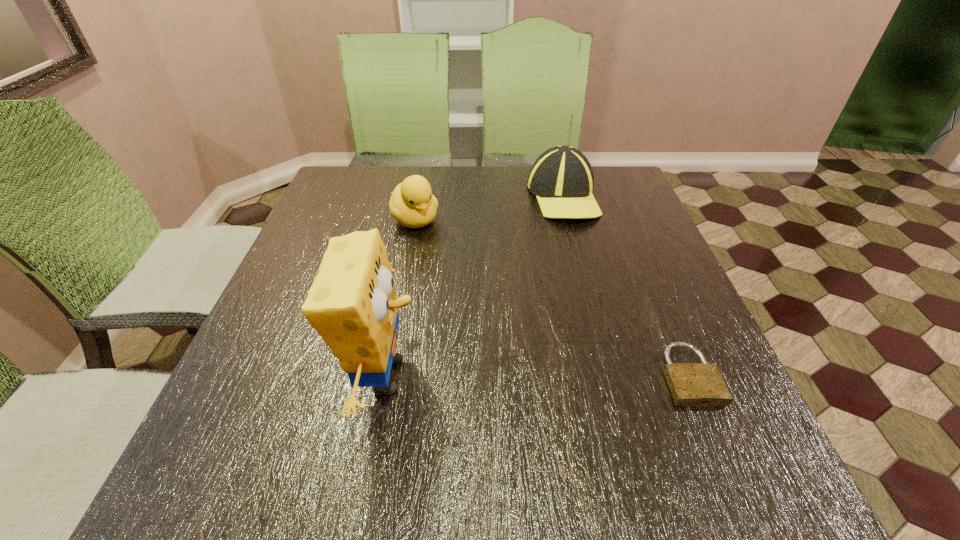
Locate an element on the screen. Image resolution: width=960 pixels, height=540 pixels. object that is at the far right corner is located at coordinates tap(562, 179).

Identify the location of object at the near right corner. The image size is (960, 540). (691, 384).

Locate an element on the screen. vacant space at the far edge of the desktop is located at coordinates (455, 180).

You are a GUI agent. You are given a task and a screenshot of the screen. Output one action in this format:
    pyautogui.click(x=<x>, y=<y>)
    Task: Click on the vacant area at the near edge of the desktop
    
    Given the screenshot: What is the action you would take?
    pyautogui.click(x=382, y=396)

Where is `free space at the left edge of the desktop`? Image resolution: width=960 pixels, height=540 pixels. free space at the left edge of the desktop is located at coordinates (320, 252).

This screenshot has width=960, height=540. Identify the location of free spot at the right edge of the desktop. (655, 268).

What are the coordinates of `vacant space at the far left corner of the desktop` in the screenshot? It's located at (358, 173).

In order to click on free location at the near left corner of the desktop in this screenshot , I will do `click(234, 436)`.

At what (x,y) coordinates should I click in order to perform the action: click on empty space that is in between the sponge and the padlock. Please return your answer as a coordinate pair (x, y). Image resolution: width=960 pixels, height=540 pixels. Looking at the image, I should click on (537, 375).

Identify the location of empty location between the baseball cap and the sponge. The width and height of the screenshot is (960, 540). (474, 286).